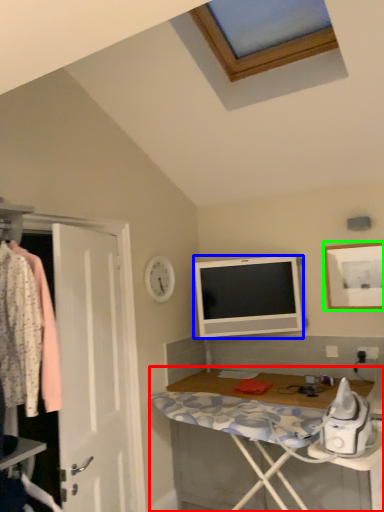
Question: Considering the real-world distances, which object is closest to desk (highlighted by a red box)? television (highlighted by a blue box) or picture frame (highlighted by a green box).

Choices:
 (A) television
 (B) picture frame

Answer: (A)